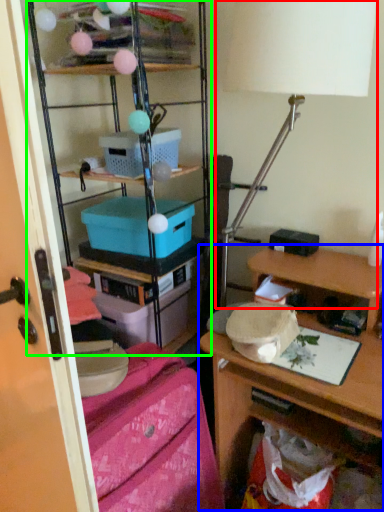
Question: Which object is the farthest from table lamp (highlighted by a red box)? Choose among these: desk (highlighted by a blue box) or shelf (highlighted by a green box).

Choices:
 (A) desk
 (B) shelf

Answer: (B)